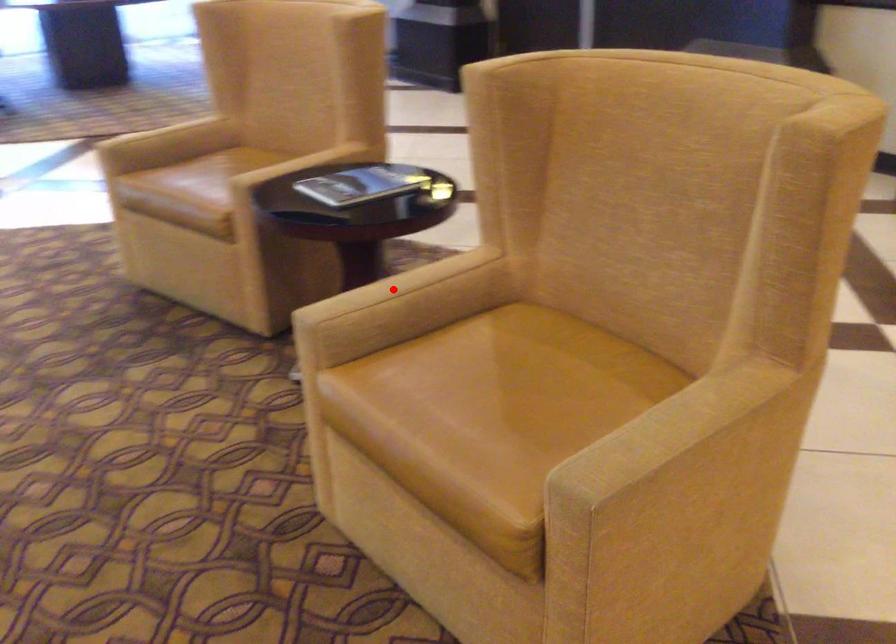
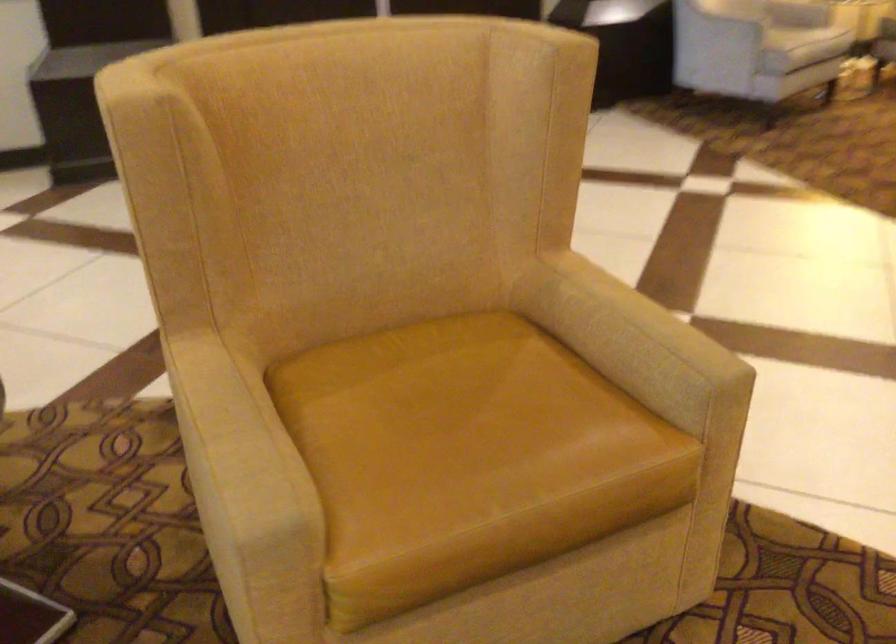
In the second image, find the point that corresponds to the highlighted location in the first image.

(235, 435)